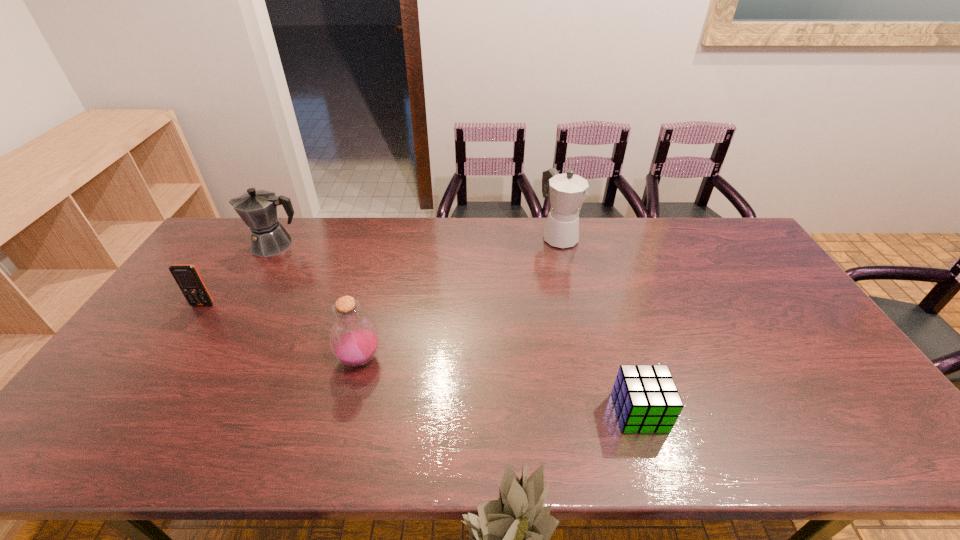
In order to click on blank area located at the spout of the shorter coffeepot in this screenshot , I will do `click(227, 245)`.

This screenshot has width=960, height=540. I want to click on free space located 0.190m on the front of the third object from left to right, so click(x=338, y=448).

At what (x,y) coordinates should I click in order to perform the action: click on free space located 0.230m on the screen of the cellular telephone. Please return your answer as a coordinate pair (x, y). The image size is (960, 540). Looking at the image, I should click on (160, 369).

Find the location of `vacant region located on the right of the cube`. vacant region located on the right of the cube is located at coordinates (717, 413).

Locate an element on the screen. This screenshot has height=540, width=960. object at the near edge is located at coordinates (646, 399).

Locate an element on the screen. coffeepot that is at the left edge is located at coordinates 258,209.

Identify the location of cellular telephone that is at the left edge. (187, 277).

What are the coordinates of `object that is at the far left corner` in the screenshot? It's located at (258, 209).

The height and width of the screenshot is (540, 960). I want to click on free space at the far edge of the desktop, so click(532, 247).

This screenshot has width=960, height=540. In the image, there is a desktop. What are the coordinates of `free space at the near edge` in the screenshot? It's located at (702, 428).